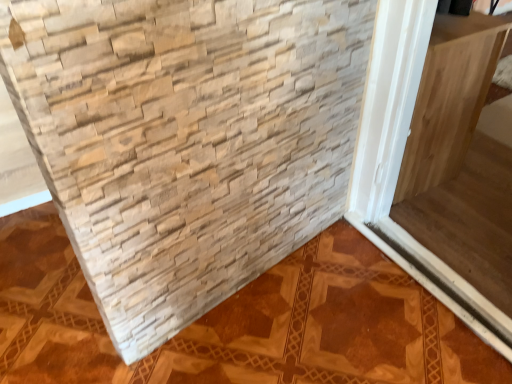
Identify the location of wooden frame at upper right. click(x=400, y=166).

This screenshot has height=384, width=512. What do you see at coordinates (400, 166) in the screenshot? I see `wooden frame at upper right` at bounding box center [400, 166].

Find the location of a particular element. This screenshot has height=384, width=512. wooden frame at upper right is located at coordinates (400, 166).